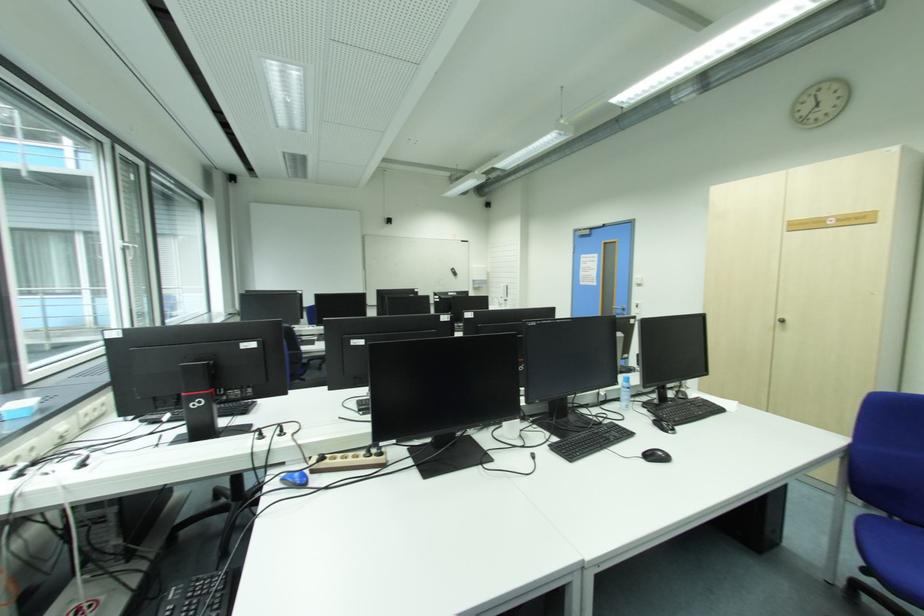
Identify the location of blue computer mouse. (295, 477).